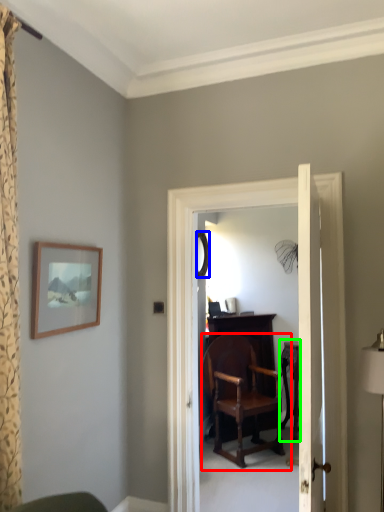
Question: Considering the real-world distances, which object is closest to chair (highlighted by a red box)? mirror (highlighted by a blue box) or table (highlighted by a green box).

Choices:
 (A) mirror
 (B) table

Answer: (B)